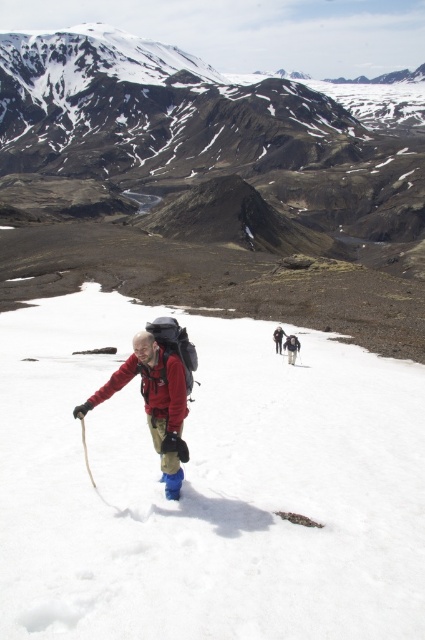
Question: Which point is farther from the camera taking this photo?

Choices:
 (A) (320, 595)
 (B) (170, 408)
 (C) (277, 340)

Answer: (C)

Question: Which object appears closest to the camera in this image?

Choices:
 (A) dark gray backpack at center
 (B) matte black backpack at center
 (C) white fluffy snow at center

Answer: (C)

Question: Does dark brown rocky mountain at upper center come behind matte black backpack at center?

Choices:
 (A) yes
 (B) no

Answer: (A)

Question: Can you confirm if matte red jacket at center is positioned to the right of dark gray backpack at center?

Choices:
 (A) no
 (B) yes

Answer: (A)

Question: Can you confirm if dark brown rocky mountain at upper center is positioned above matte black backpack at center?

Choices:
 (A) yes
 (B) no

Answer: (A)

Question: Estimate the real-world distances between objects in this image. Which object is farther from the dark brown rocky mountain at upper center?

Choices:
 (A) dark gray backpack at center
 (B) white fluffy snow at center
 (C) matte red jacket at center

Answer: (A)